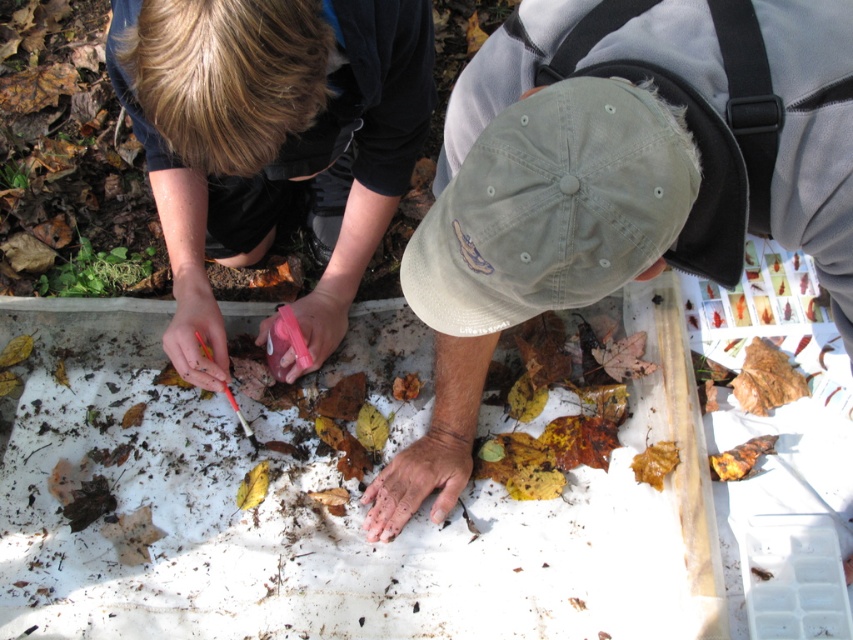
You are a photographer trying to capture the two points in the scene. Which point, point (560, 92) or point (416, 492), will appear larger in your photo?

Point (560, 92) will appear larger in the photo because it is closer to the camera than point (416, 492).

Based on the scene described, which object is larger in size between the smooth black shirt at upper left and the khaki fabric baseball cap at center?

The smooth black shirt at upper left is bigger than the khaki fabric baseball cap at center according to the description.